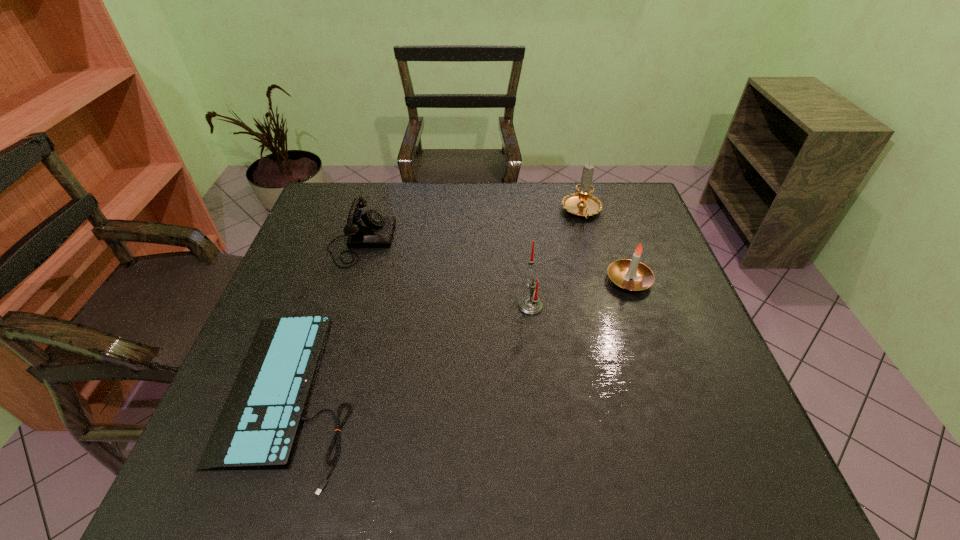
Identify the location of vacant space that satisfies the following two spatial constraints: 1. on the front face of the fourth tallest object; 2. on the right side of the third tallest object. (349, 280).

This screenshot has width=960, height=540. I want to click on vacant position in the image that satisfies the following two spatial constraints: 1. on the front side of the farthest candle; 2. on the front-facing side of the leftmost candle, so click(x=609, y=306).